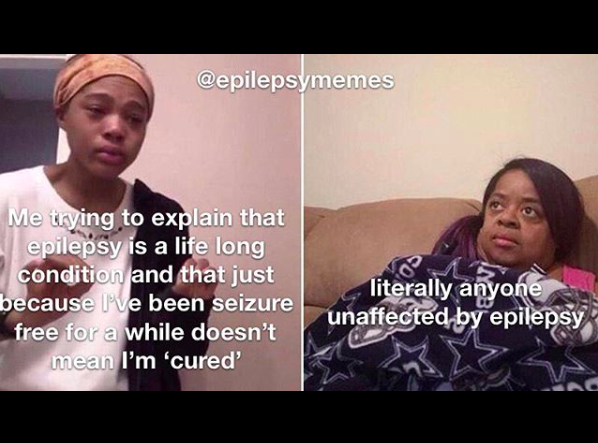
Locate an element on the screen. The width and height of the screenshot is (598, 443). wall is located at coordinates (203, 145).